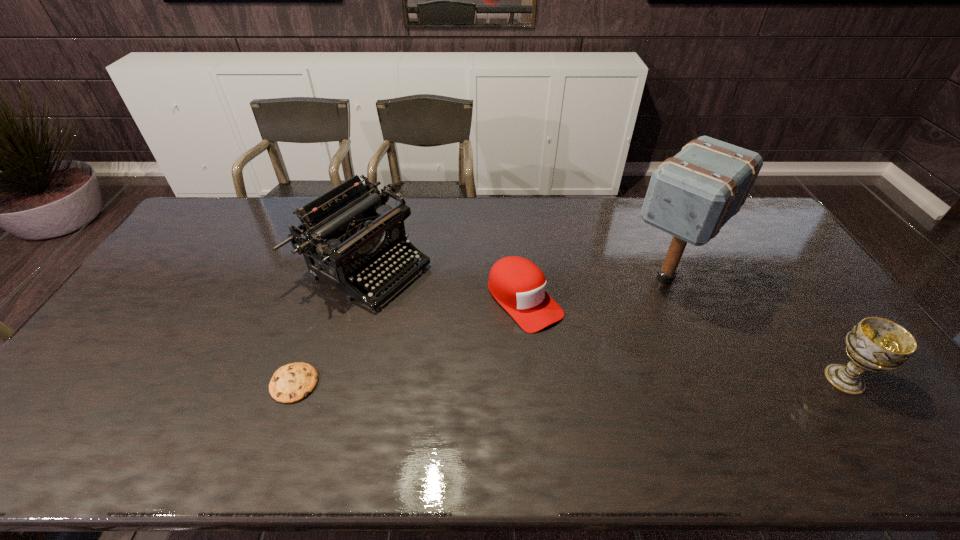
The height and width of the screenshot is (540, 960). What are the coordinates of `cookie that is at the near edge` in the screenshot? It's located at (293, 382).

You are a GUI agent. You are given a task and a screenshot of the screen. Output one action in this format:
    pyautogui.click(x=<x>, y=<y>)
    Task: Click on the chalice that is at the near edge
    
    Given the screenshot: What is the action you would take?
    point(877,344)

This screenshot has height=540, width=960. What are the coordinates of `object that is at the right edge` in the screenshot? It's located at (877, 344).

Locate an element on the screen. Image resolution: width=960 pixels, height=540 pixels. object that is at the near right corner is located at coordinates (877, 344).

The image size is (960, 540). What are the coordinates of `free space at the far edge of the desktop` in the screenshot? It's located at (604, 203).

At what (x,y) coordinates should I click in order to perform the action: click on free space at the near edge of the desktop. Please return your answer as a coordinate pair (x, y). This screenshot has width=960, height=540. Looking at the image, I should click on (783, 407).

Locate an element on the screen. The image size is (960, 540). vacant space at the left edge is located at coordinates (152, 338).

I want to click on free space at the right edge, so click(776, 245).

Where is `vacant area at the far left corner of the desktop`? vacant area at the far left corner of the desktop is located at coordinates (231, 198).

This screenshot has width=960, height=540. I want to click on free space between the chalice and the fourth tallest object, so click(684, 340).